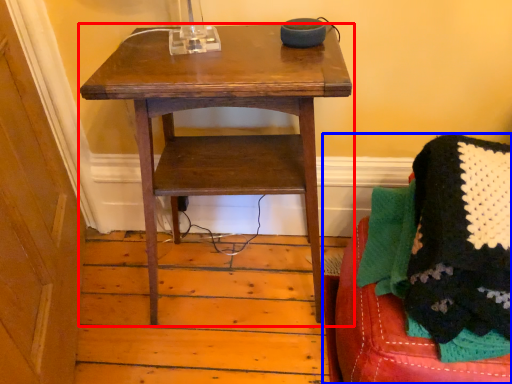
Question: Which object is closer to the camera taking this photo, table (highlighted by a red box) or furniture (highlighted by a blue box)?

Choices:
 (A) table
 (B) furniture

Answer: (B)